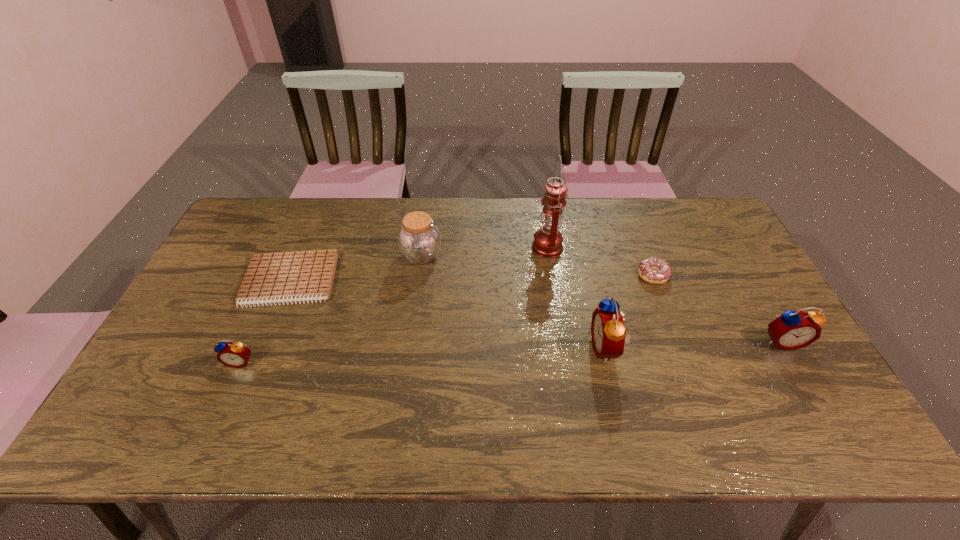
If equal spacing is the goal by inserting an additional alarm_clock among them, please point out a vacant space for this new alarm_clock. Please provide its 2D coordinates. Your answer should be formatted as a tuple, i.e. [(x, y)], where the tuple contains the x and y coordinates of a point satisfying the conditions above.

[(425, 355)]